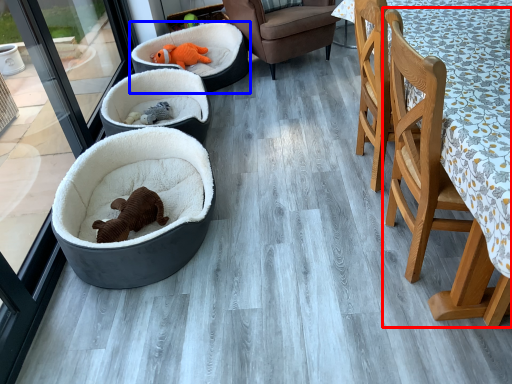
Question: Which object is further to the camera taking this photo, chair (highlighted by a red box) or dog bed (highlighted by a blue box)?

Choices:
 (A) chair
 (B) dog bed

Answer: (B)